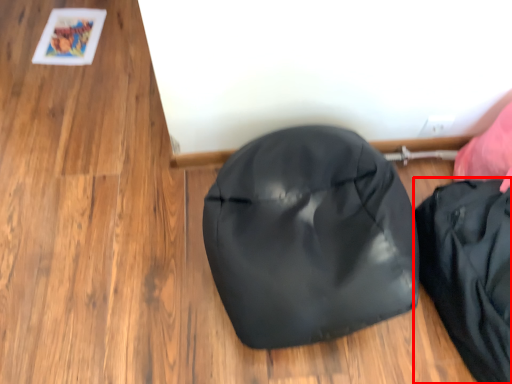
Question: In this image, where is pouch (annotated by the red box) located relative to footwear?

Choices:
 (A) left
 (B) right

Answer: (B)